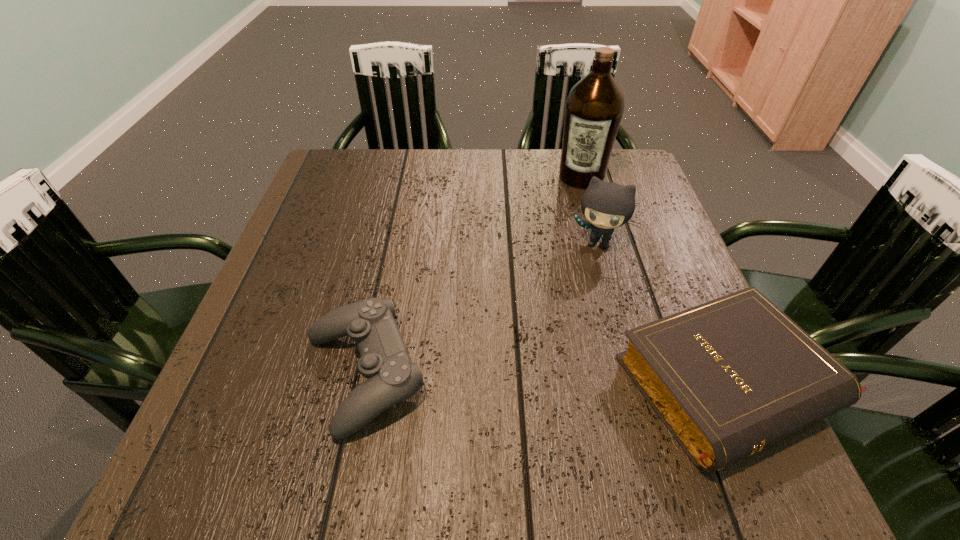
Locate an element on the screen. The width and height of the screenshot is (960, 540). control is located at coordinates click(x=391, y=376).

This screenshot has height=540, width=960. Find the location of `Bible`. Bible is located at coordinates (729, 377).

The height and width of the screenshot is (540, 960). What are the coordinates of `olive oil` in the screenshot? It's located at (594, 108).

This screenshot has height=540, width=960. What are the coordinates of `the tallest object` in the screenshot? It's located at (594, 108).

The image size is (960, 540). Identify the location of the second tallest object. (606, 205).

I want to click on the third nearest object, so coord(606,205).

Where is `vacant area located 0.400m on the back of the leftmost object`? vacant area located 0.400m on the back of the leftmost object is located at coordinates click(x=401, y=197).

You are a GUI agent. You are given a task and a screenshot of the screen. Output one action in this format:
    pyautogui.click(x=<x>, y=<y>)
    Task: Click on the vacant region located on the left of the Bible
    
    Given the screenshot: What is the action you would take?
    pyautogui.click(x=518, y=383)

The width and height of the screenshot is (960, 540). In order to click on free space located 0.300m on the label of the farthest object in this screenshot , I will do `click(553, 266)`.

You are a GUI agent. You are given a task and a screenshot of the screen. Output one action in this format:
    pyautogui.click(x=<x>, y=<y>)
    Task: Click on the free location located on the label of the farthest object
    Image resolution: width=960 pixels, height=540 pixels.
    Given the screenshot: What is the action you would take?
    click(546, 285)